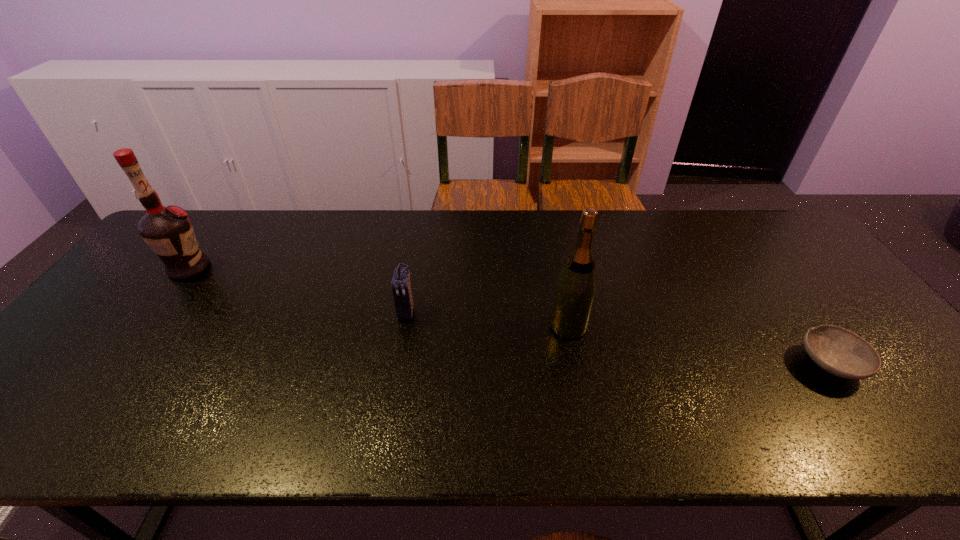
I want to click on object that stands as the closest to the shortest object, so click(575, 290).

Identify the location of object that stands as the closest to the farthest object. The width and height of the screenshot is (960, 540). (401, 285).

The width and height of the screenshot is (960, 540). Identify the location of vacant area that satisfies the following two spatial constraints: 1. with the zip open on the bowl; 2. on the left side of the second object from left to right. (397, 364).

This screenshot has height=540, width=960. Identify the location of free location that satisfies the following two spatial constraints: 1. with the zip open on the clutch bag; 2. on the left side of the rightmost object. (397, 364).

The height and width of the screenshot is (540, 960). I want to click on free location that satisfies the following two spatial constraints: 1. on the front-facing side of the bowl; 2. on the right side of the third object from left to right, so click(x=576, y=364).

This screenshot has height=540, width=960. What are the coordinates of `blank area in the image that satisfies the following two spatial constraints: 1. on the front and back of the leftmost object; 2. on the back side of the bowl` in the screenshot? It's located at (117, 364).

Locate an element on the screen. The width and height of the screenshot is (960, 540). free spot that satisfies the following two spatial constraints: 1. with the zip open on the rightmost object; 2. on the left side of the third tallest object is located at coordinates (397, 364).